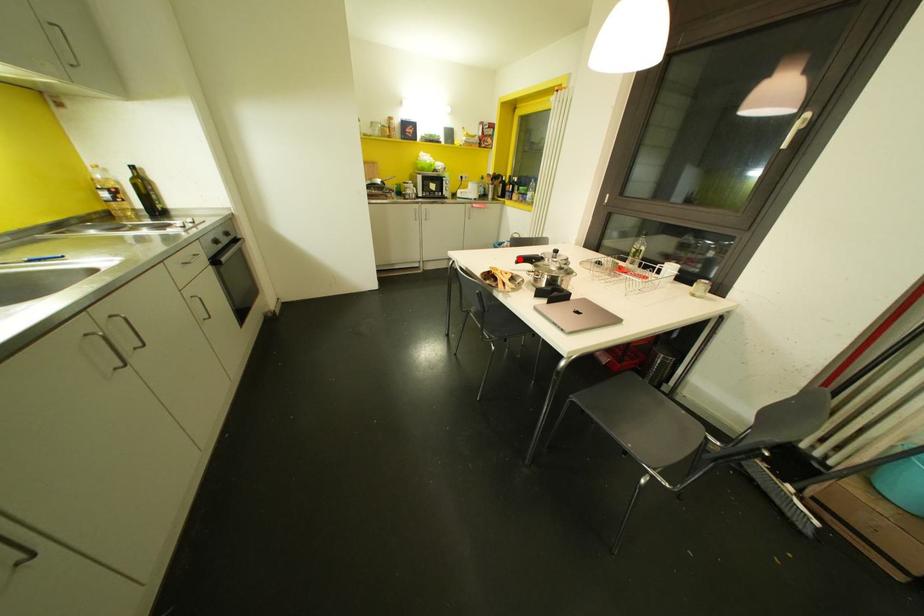
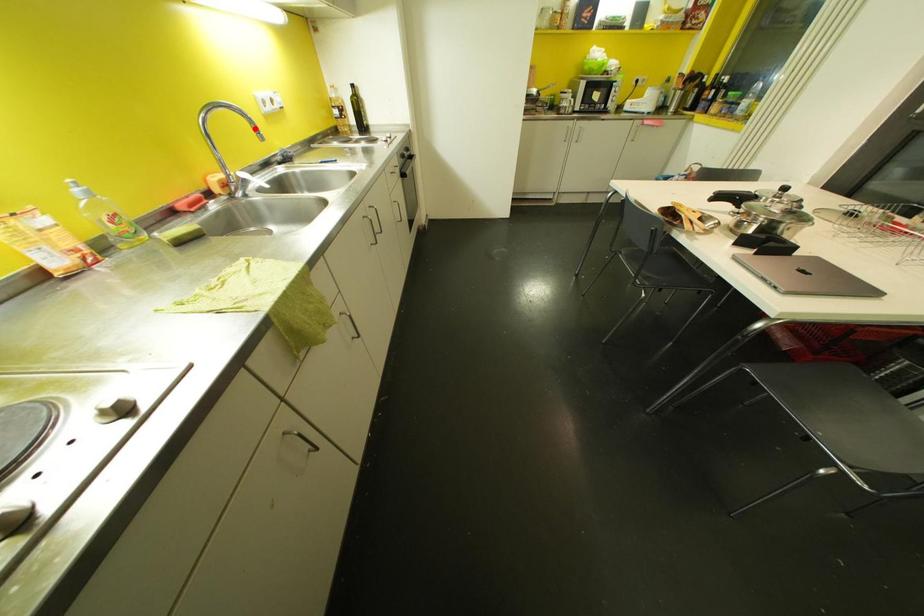
I am providing you with two images of the same scene from different viewpoints. A red point is marked on the first image and another point is marked on the second image. Are the points marked in image1 and image2 representing the same 3D position?

No